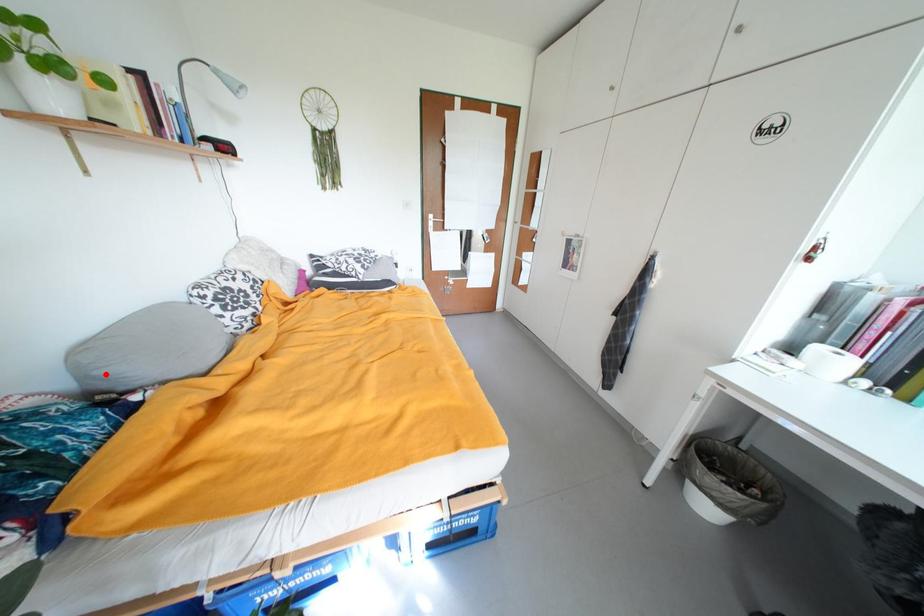
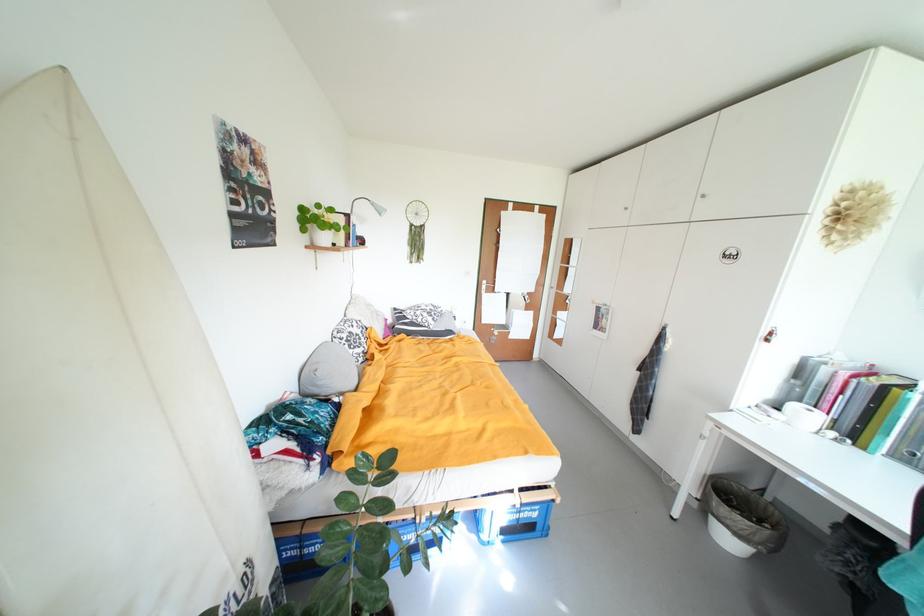
Find the pixel in the second image that matches the highlighted location in the first image.

(326, 385)